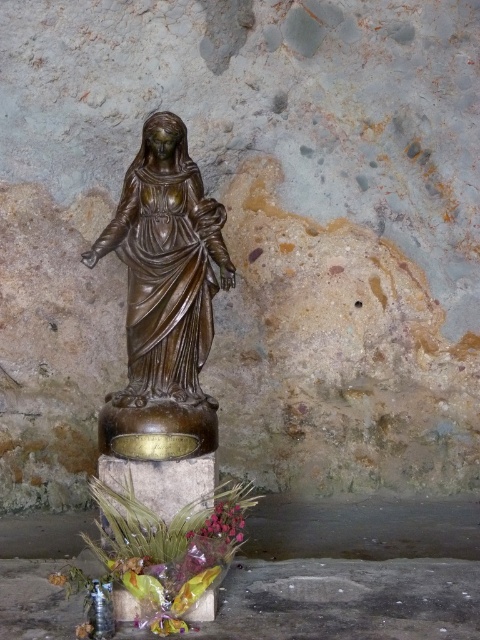
Can you confirm if bronze statue at center is positioned to the right of pink matte petals at lower center?

A: In fact, bronze statue at center is to the left of pink matte petals at lower center.

Which is more to the left, bronze statue at center or pink matte petals at lower center?

bronze statue at center is more to the left.

Who is more forward, [192,385] or [217,509]?

Point [217,509] is more forward.

This screenshot has height=640, width=480. Identify the location of bronze statue at center. (166, 266).